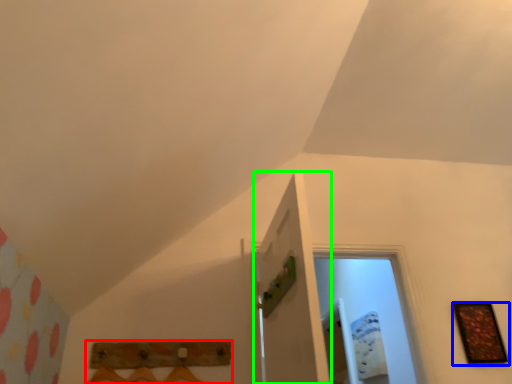
Question: Based on their relative distances, which object is nearer to furniture (highlighted by a red box)? Choose from picture frame (highlighted by a blue box) and door (highlighted by a green box).

Choices:
 (A) picture frame
 (B) door

Answer: (B)